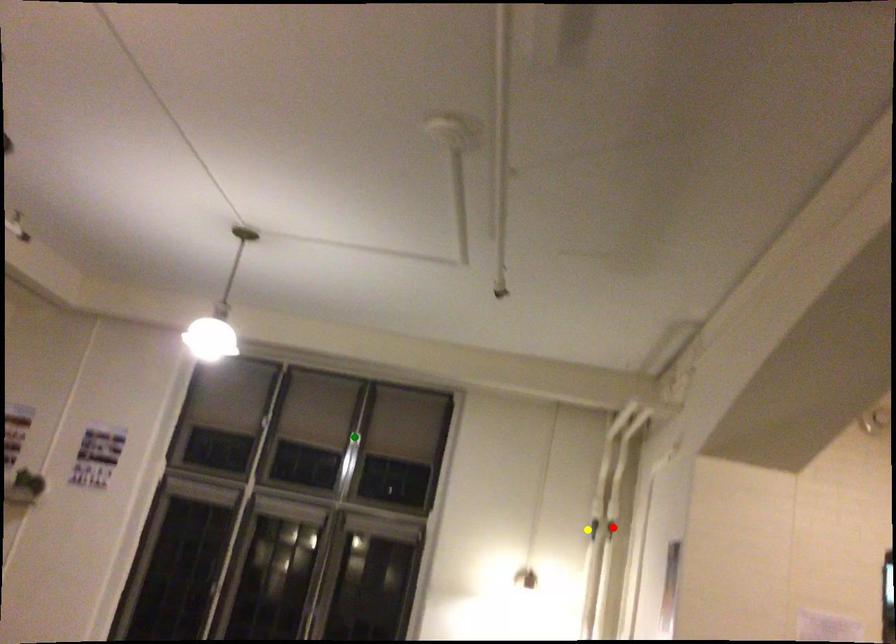
Order these from nearest to farthest:
- red point
- green point
- yellow point

red point, yellow point, green point